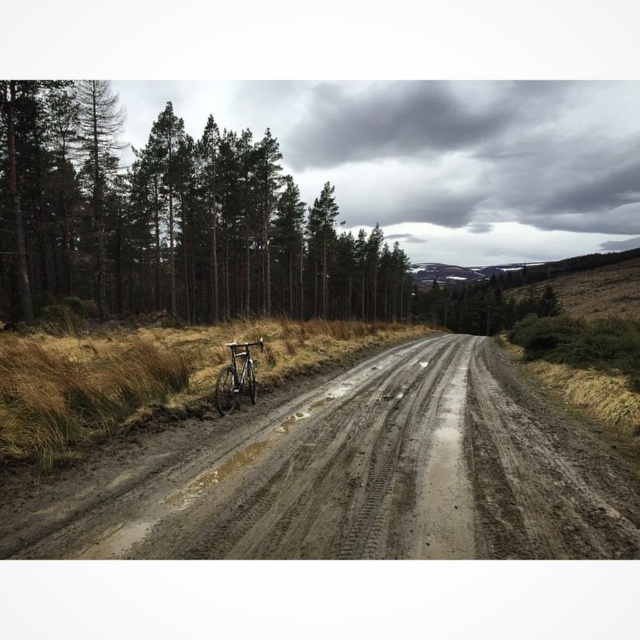
You are a cyclist who needs to reach a destination 250 meters ahead. You have a choice between riding along the dirt road or cutting across the grassy terrain to the right. The silver metallic bicycle at center is your current position. Considering the distance to the green matte trees at left, which path would allow you to reach your destination faster?

The distance from the silver metallic bicycle at center to the green matte trees at left is 237.86 meters. Since your destination is 250 meters ahead, riding along the dirt road would allow you to reach the destination faster because you can continue straight on the road without deviating, whereas cutting across the grass might add extra distance beyond the 250 meters required.

You are standing on the dirt road in the rural scene. You see two points marked on the road. The first point is at coordinates point [240,282] and the second is at point [225,403]. If you want to walk towards the background of the image, which point will you pass first?

You will pass point [225,403] first because it is closer to the background than point [240,282], which is nearer to the camera.

You are a hiker who wants to cross the dull gray mud at left. The mud is 90 meters away from you. Can you reach it without walking further than 90 meters?

The dull gray mud at left is 91.01 meters from viewer, so you cannot reach it without walking further than 90 meters.